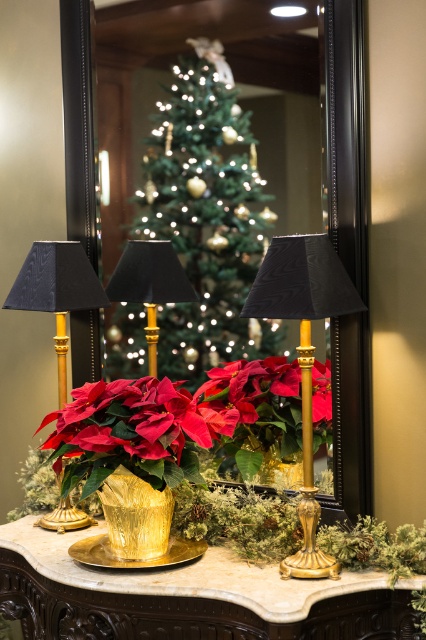
Question: Is matte gold pot at center wider than matte black lampshade at center?

Choices:
 (A) no
 (B) yes

Answer: (B)

Question: Is gold textured table at center smaller than matte black lampshade at center?

Choices:
 (A) yes
 (B) no

Answer: (B)

Question: In this image, where is matte black lampshade at left located relative to black fabric lampshade at center?

Choices:
 (A) above
 (B) below

Answer: (B)

Question: Which point appears farthest from the camera in this image?

Choices:
 (A) (308, 493)
 (B) (184, 195)
 (C) (354, 604)
 (D) (256, 464)

Answer: (B)

Question: Among these points, which one is farthest from the camera?

Choices:
 (A) (46, 273)
 (B) (363, 624)
 (C) (68, 412)

Answer: (A)

Question: Based on their relative distances, which object is nearer to the black fabric lampshade at center?

Choices:
 (A) green textured christmas tree at center
 (B) matte black lampshade at center
 (C) matte black lampshade at left

Answer: (A)